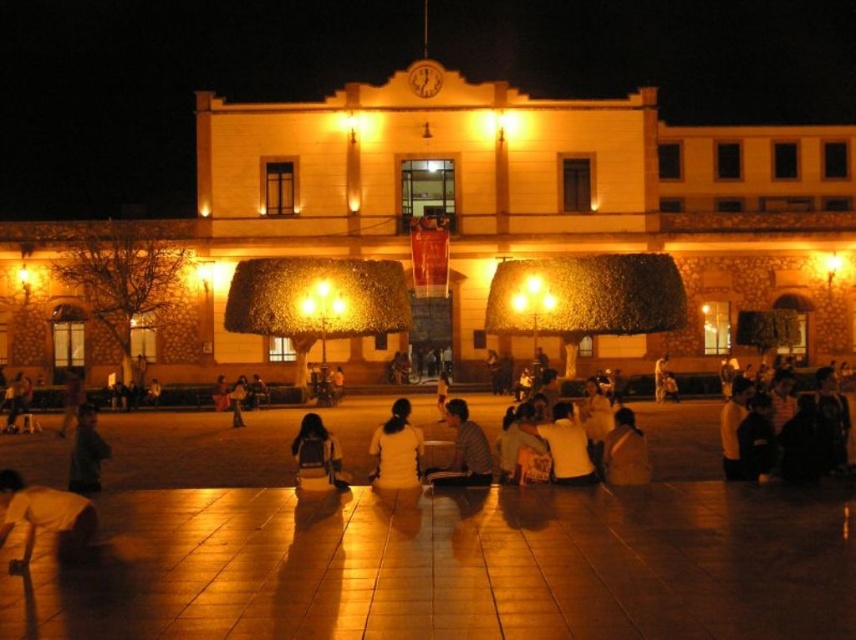
Consider the image. Can you confirm if yellow cotton jacket at lower left is taller than light brown leather jacket at lower right?

Yes, yellow cotton jacket at lower left is taller than light brown leather jacket at lower right.

Is point (10, 522) closer to camera compared to point (629, 428)?

That is True.

This screenshot has width=856, height=640. I want to click on yellow cotton jacket at lower left, so click(45, 516).

Is white shirt at center shorter than matte black backpack at center?

Correct, white shirt at center is not as tall as matte black backpack at center.

Is white shirt at center wider than matte black backpack at center?

In fact, white shirt at center might be narrower than matte black backpack at center.

What do you see at coordinates (565, 444) in the screenshot?
I see `white shirt at center` at bounding box center [565, 444].

The height and width of the screenshot is (640, 856). I want to click on white shirt at center, so click(565, 444).

Does white matte shirt at center appear under light brown leather jacket at center?

Indeed, white matte shirt at center is positioned under light brown leather jacket at center.

Is white matte shirt at center thinner than light brown leather jacket at center?

Yes.

Between point (387, 429) and point (488, 445), which one is positioned in front?

Point (387, 429) is in front.

Where is `white matte shirt at center`? This screenshot has height=640, width=856. white matte shirt at center is located at coordinates (396, 449).